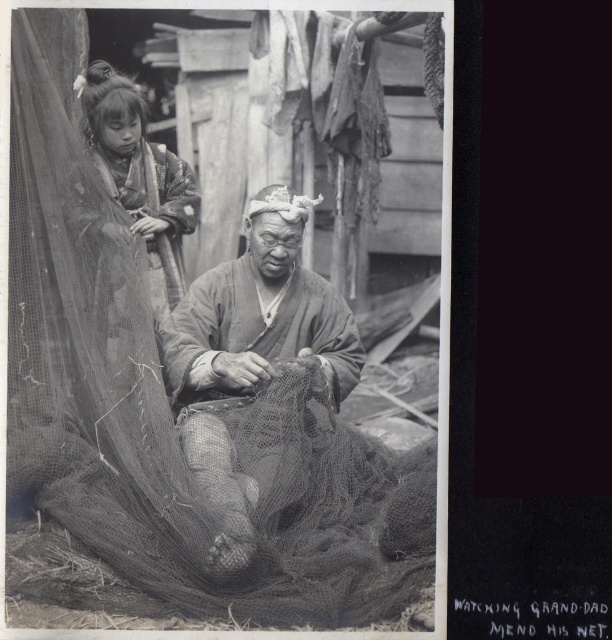
Based on the scene described, which object is taller when comparing the coarse mesh net at center and the matte fabric man at center?

The coarse mesh net at center is taller than the matte fabric man at center according to the description provided.

What is located at the coordinates point (165, 417) in the image?

The coarse mesh net at center is located at point (165, 417).

Based on the scene description, which object is bigger between the matte fabric man at center and the smooth fabric kimono at upper left?

The matte fabric man at center is larger in size compared to the smooth fabric kimono at upper left according to the description.